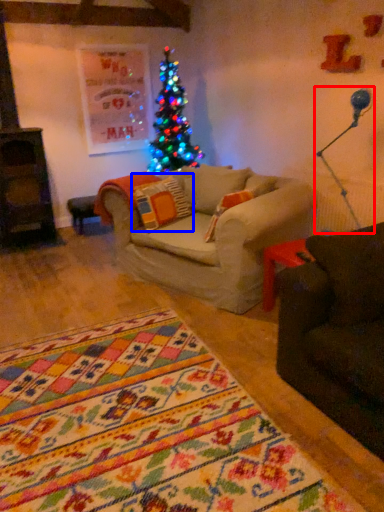
Question: Which object is further to the camera taking this photo, lamp (highlighted by a red box) or pillow (highlighted by a blue box)?

Choices:
 (A) lamp
 (B) pillow

Answer: (B)